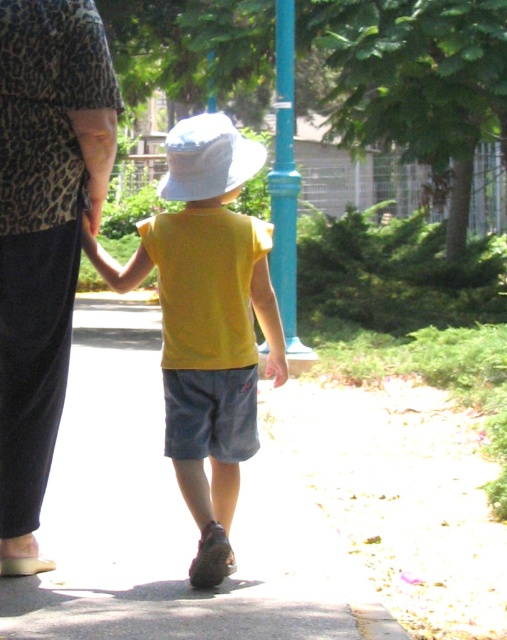
Between point (123, 397) and point (66, 156), which one is positioned in front?

Point (66, 156) is more forward.

Does gray concrete pavement at center appear over leopard print blouse at upper left?

Actually, gray concrete pavement at center is below leopard print blouse at upper left.

Describe the element at coordinates (170, 518) in the screenshot. I see `gray concrete pavement at center` at that location.

Locate an element on the screen. gray concrete pavement at center is located at coordinates (170, 518).

Identify the location of yellow matte shirt at center. (206, 321).

Between point (248, 243) and point (199, 138), which one is positioned in front?

Point (199, 138)

Does point (162, 250) come farther from viewer compared to point (240, 152)?

No, it is not.

Where is `yellow matte shirt at center`? The image size is (507, 640). yellow matte shirt at center is located at coordinates click(x=206, y=321).

Does gray concrete pavement at center appear on the left side of yellow matte shirt at center?

Indeed, gray concrete pavement at center is positioned on the left side of yellow matte shirt at center.

Which is above, gray concrete pavement at center or yellow matte shirt at center?

yellow matte shirt at center is higher up.

Does point (263, 616) come farther from viewer compared to point (210, 129)?

That is False.

The image size is (507, 640). In order to click on gray concrete pavement at center in this screenshot , I will do `click(170, 518)`.